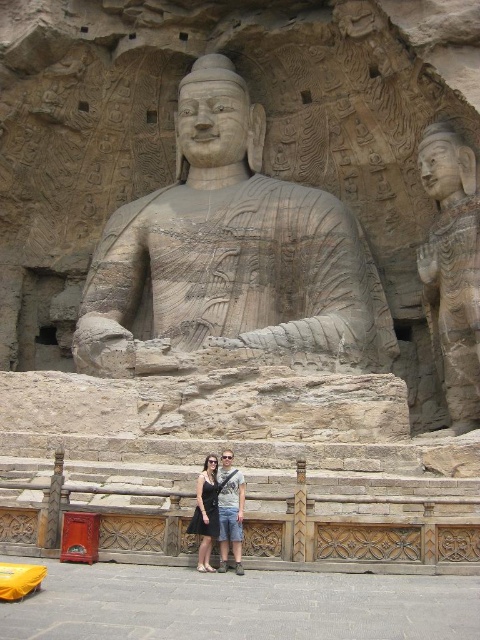
Question: Does matte stone statue at upper right appear under black dress at center?

Choices:
 (A) yes
 (B) no

Answer: (B)

Question: Estimate the real-world distances between objects in this image. Which object is closer to the matte stone statue at upper right?

Choices:
 (A) black dress at center
 (B) light brown stone statue at center

Answer: (B)

Question: Is gray stone statue at center thinner than matte stone statue at upper right?

Choices:
 (A) yes
 (B) no

Answer: (B)

Question: Which point appears farthest from the camera in this image?

Choices:
 (A) (433, 172)
 (B) (188, 528)
 (C) (217, 499)
 (D) (186, 232)

Answer: (D)

Question: Is gray stone statue at center further to camera compared to light brown stone statue at center?

Choices:
 (A) no
 (B) yes

Answer: (B)

Question: Which object is the closest to the matte stone statue at upper right?

Choices:
 (A) black dress at center
 (B) light brown stone statue at center
 (C) gray stone statue at center

Answer: (C)